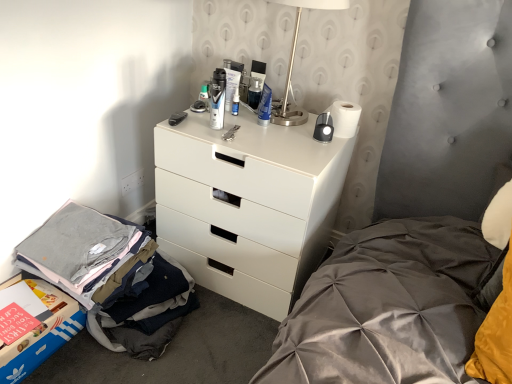
Locate an element on the screen. vacant area that lies between white matte toilet paper at upper right and matte plastic tube at upper center, which ranks as the third toiletry in left-to-right order is located at coordinates (280, 121).